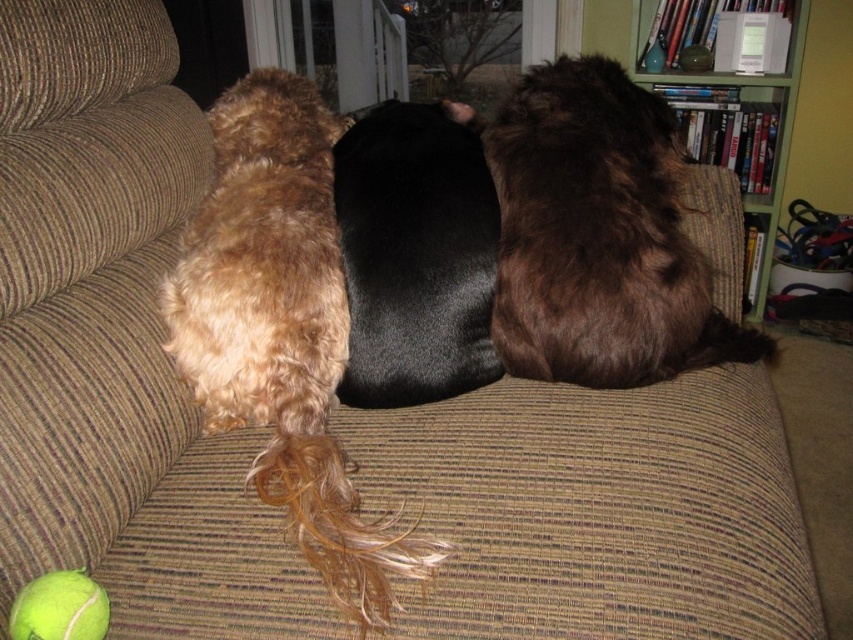
Which is more to the left, black smooth fur at center or green wood bookshelf at upper right?

From the viewer's perspective, black smooth fur at center appears more on the left side.

Is point (434, 124) closer to camera compared to point (585, 40)?

Yes, it is.

The height and width of the screenshot is (640, 853). What are the coordinates of `black smooth fur at center` in the screenshot? It's located at (415, 256).

Is shaggy golden fur at center to the left of black smooth fur at center from the viewer's perspective?

Correct, you'll find shaggy golden fur at center to the left of black smooth fur at center.

Between point (230, 124) and point (368, 314), which one is positioned in front?

Point (368, 314) is more forward.

Where is `shaggy golden fur at center`? Image resolution: width=853 pixels, height=640 pixels. shaggy golden fur at center is located at coordinates (282, 330).

Is the position of brown fluffy dog at center more distant than that of black smooth fur at center?

Yes, brown fluffy dog at center is behind black smooth fur at center.

The height and width of the screenshot is (640, 853). Describe the element at coordinates (598, 236) in the screenshot. I see `brown fluffy dog at center` at that location.

What do you see at coordinates (598, 236) in the screenshot? The height and width of the screenshot is (640, 853). I see `brown fluffy dog at center` at bounding box center [598, 236].

Where is `brown fluffy dog at center`? Image resolution: width=853 pixels, height=640 pixels. brown fluffy dog at center is located at coordinates (598, 236).